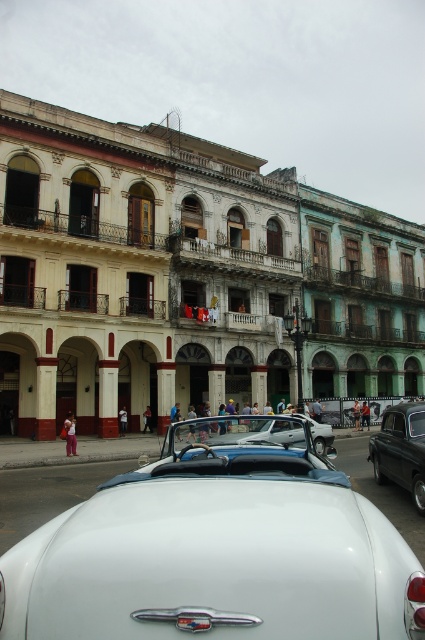
Can you confirm if white glossy car at center is taller than shiny black car at right?

Yes, white glossy car at center is taller than shiny black car at right.

Does point (353, 524) lie in front of point (404, 440)?

Yes, point (353, 524) is closer to viewer.

The width and height of the screenshot is (425, 640). Find the location of `white glossy car at center`. white glossy car at center is located at coordinates (218, 548).

How far apart are white glossy convertible at center and shiny black car at right?

They are 11.64 feet apart.

Measure the distance between white glossy convertible at center and camera.

The distance of white glossy convertible at center from camera is 7.31 meters.

Between point (192, 435) and point (419, 461), which one is positioned in front?

Point (192, 435) is more forward.

Image resolution: width=425 pixels, height=640 pixels. In order to click on white glossy convertible at center in this screenshot , I will do `click(257, 432)`.

Can you confirm if white glossy car at center is thinner than white glossy convertible at center?

No.

Is white glossy car at center shorter than white glossy convertible at center?

No.

Between point (3, 573) and point (238, 426), which one is positioned in front?

Point (3, 573)

I want to click on white glossy car at center, so click(218, 548).